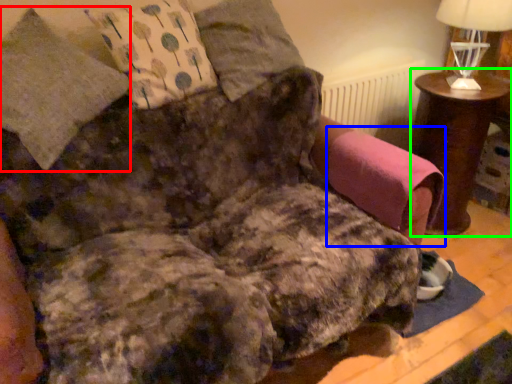
Question: Which is nearer to the pillow (highlighted by a red box)? swivel chair (highlighted by a blue box) or table (highlighted by a green box).

Choices:
 (A) swivel chair
 (B) table

Answer: (A)